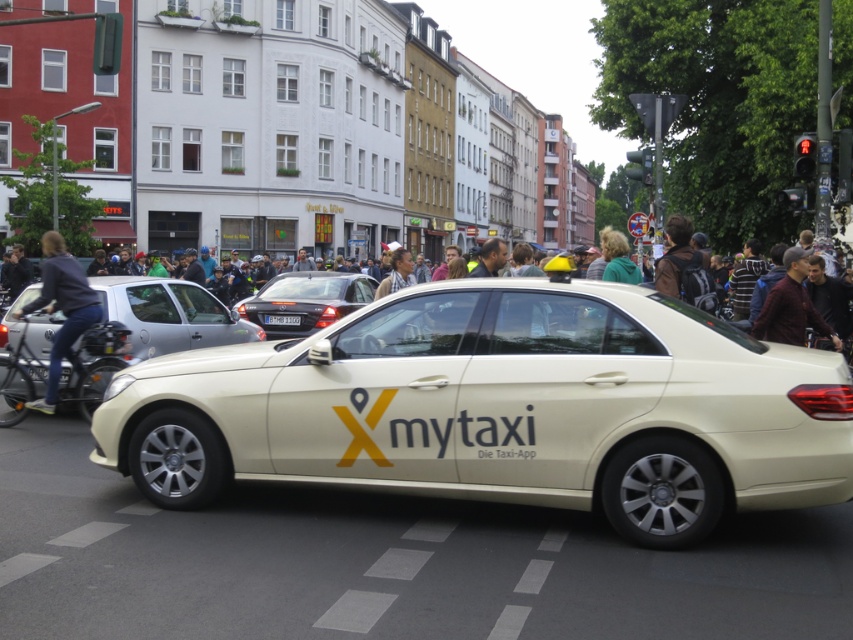
Is denim jacket at left positioned behind dark brown leather jacket at right?

Yes, denim jacket at left is behind dark brown leather jacket at right.

This screenshot has height=640, width=853. Describe the element at coordinates (61, 308) in the screenshot. I see `denim jacket at left` at that location.

What do you see at coordinates (61, 308) in the screenshot? I see `denim jacket at left` at bounding box center [61, 308].

Find the location of a particular element. denim jacket at left is located at coordinates (61, 308).

Does shiny black sedan at center have a smaller size compared to dark brown leather jacket at right?

Incorrect, shiny black sedan at center is not smaller in size than dark brown leather jacket at right.

Does point (309, 291) lie behind point (753, 321)?

Yes, it is behind point (753, 321).

Locate an element on the screen. The width and height of the screenshot is (853, 640). shiny black sedan at center is located at coordinates (306, 300).

The height and width of the screenshot is (640, 853). I want to click on shiny black sedan at center, so click(306, 300).

The width and height of the screenshot is (853, 640). Describe the element at coordinates (61, 308) in the screenshot. I see `denim jacket at left` at that location.

Between denim jacket at left and white plastic license plate at center, which one is positioned lower?

white plastic license plate at center

Find the location of `denim jacket at left`. denim jacket at left is located at coordinates (61, 308).